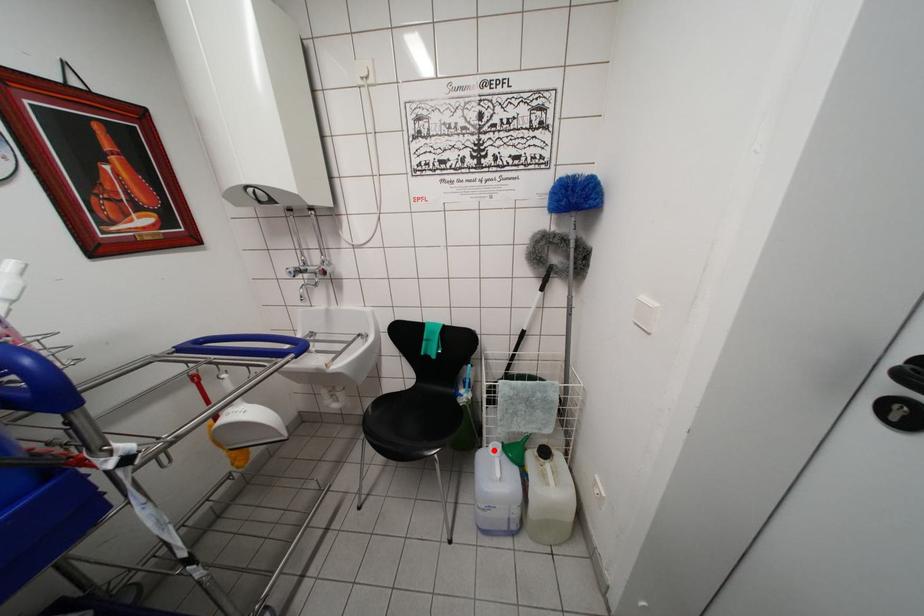
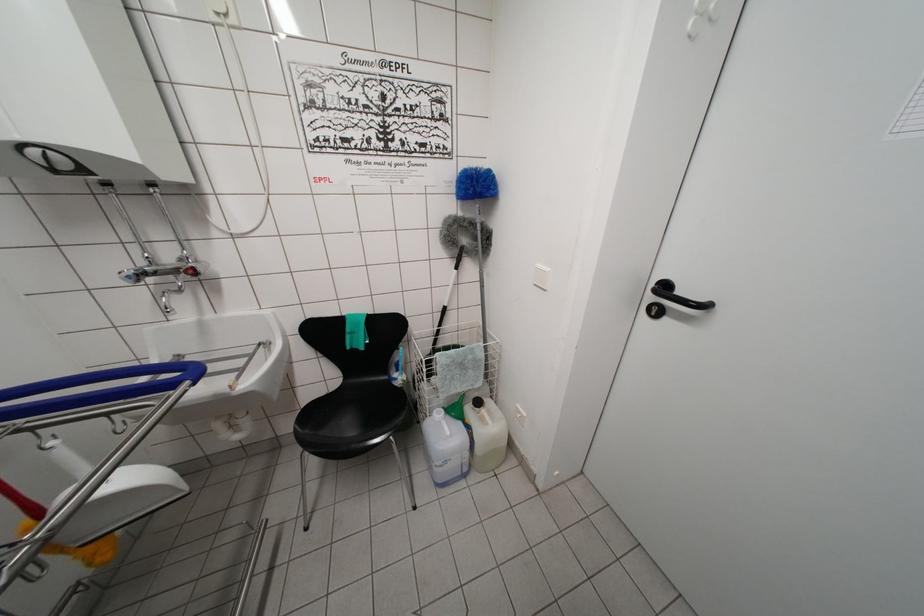
Question: I am providing you with two images of the same scene from different viewpoints. A red point is shown in image1. For the corresponding object point in image2, is it positioned nearer or farther from the camera?

Choices:
 (A) Nearer
 (B) Farther

Answer: (B)